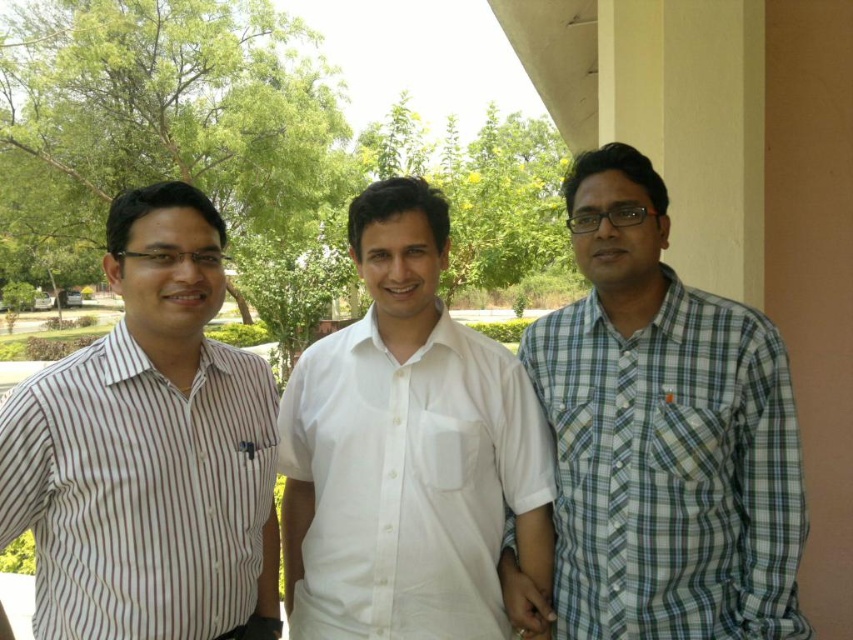
You are standing in the park and want to take a photo of the point at coordinates point (660,632). The camera you are using has a focal length of 50mm and a sensor size of 24mm x 36mm. If the point is 6.86 feet from the camera, what is the approximate size in millimeters of the image of the point on the camera sensor?

The point at coordinates point (660,632) is 6.86 feet from the camera. Using the formula for image size calculation, the image size can be approximated by multiplying the actual size by the focal length divided by the distance. However, since the actual size of the point isn not provided, we cannot compute the exact image size. Please provide the actual size of the point to proceed.

You are standing in a park and want to place a picnic blanket at point [666,385]. If you walk straight ahead, how far will you have to walk to reach that point?

The distance between you and point [666,385] is 2.16 meters, so you will have to walk 2.16 meters straight ahead to reach it.